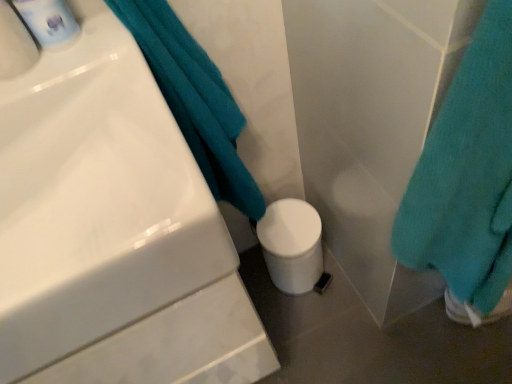
In order to face teal soft towel at upper left, the 1th bath towel positioned from the left, should I rotate leftwards or rightwards?

Turn left by 8.368 degrees to look at teal soft towel at upper left, the 1th bath towel positioned from the left.

You are a GUI agent. You are given a task and a screenshot of the screen. Output one action in this format:
    pyautogui.click(x=<x>, y=<y>)
    Task: Click on the white glossy sink at upper left
    The width and height of the screenshot is (512, 384).
    Given the screenshot: What is the action you would take?
    pyautogui.click(x=112, y=232)

Is teal soft towel at lower right, the 2th bath towel viewed from the left, in contact with white glossy mouthwash at upper left?

No, teal soft towel at lower right, the 2th bath towel viewed from the left, is not with white glossy mouthwash at upper left.

Which point is more forward, (494,319) or (35,30)?

The point (35,30) is closer.

From a real-world perspective, who is located higher, teal soft towel at lower right, which is counted as the first bath towel, starting from the right, or white glossy mouthwash at upper left?

From a 3D spatial view, white glossy mouthwash at upper left is above.

Would you say teal soft towel at lower right, which is counted as the first bath towel, starting from the right, contains white glossy mouthwash at upper left?

No, white glossy mouthwash at upper left is not a part of teal soft towel at lower right, which is counted as the first bath towel, starting from the right.

Does point (439, 234) come in front of point (117, 175)?

No.

The width and height of the screenshot is (512, 384). Identify the location of bath towel that is below the white glossy sink at upper left (from the image's perspective). (467, 181).

Could you tell me if teal soft towel at lower right, the 2th bath towel viewed from the left, is turned towards white glossy sink at upper left?

No, teal soft towel at lower right, the 2th bath towel viewed from the left, is not turned towards white glossy sink at upper left.

Based on the photo, considering the sizes of objects teal soft towel at lower right, the 2th bath towel viewed from the left, and white glossy sink at upper left in the image provided, who is wider, teal soft towel at lower right, the 2th bath towel viewed from the left, or white glossy sink at upper left?

white glossy sink at upper left is wider.

How many degrees apart are the facing directions of teal soft towel at lower right, which is counted as the first bath towel, starting from the right, and teal soft towel at upper left, the 1th bath towel positioned from the left?

The angular difference between teal soft towel at lower right, which is counted as the first bath towel, starting from the right, and teal soft towel at upper left, the 1th bath towel positioned from the left, is 0.175 degrees.

Considering the relative positions of teal soft towel at lower right, which is counted as the first bath towel, starting from the right, and teal soft towel at upper left, the 1th bath towel positioned from the left, in the image provided, is teal soft towel at lower right, which is counted as the first bath towel, starting from the right, to the left of teal soft towel at upper left, the 1th bath towel positioned from the left, from the viewer's perspective?

Incorrect, teal soft towel at lower right, which is counted as the first bath towel, starting from the right, is not on the left side of teal soft towel at upper left, the 1th bath towel positioned from the left.

Is teal soft towel at lower right, the 2th bath towel viewed from the left, next to teal soft towel at upper left, the 1th bath towel positioned from the left, and touching it?

No, teal soft towel at lower right, the 2th bath towel viewed from the left, is not making contact with teal soft towel at upper left, the 1th bath towel positioned from the left.

Does teal soft towel at lower right, the 2th bath towel viewed from the left, come behind teal soft towel at upper left, which appears as the second bath towel when viewed from the right?

No, it is in front of teal soft towel at upper left, which appears as the second bath towel when viewed from the right.

From a real-world perspective, who is located lower, white glossy sink at upper left or white glossy mouthwash at upper left?

From a 3D spatial view, white glossy sink at upper left is below.

Measure the distance from white glossy sink at upper left to white glossy mouthwash at upper left.

12.92 inches.

Is white glossy sink at upper left shorter than white glossy mouthwash at upper left?

Yes.

Is white glossy sink at upper left positioned far away from white glossy mouthwash at upper left?

No, white glossy sink at upper left is in close proximity to white glossy mouthwash at upper left.

Identify the location of mouthwash above the teal soft towel at lower right, the 2th bath towel viewed from the left (from a real-world perspective). This screenshot has height=384, width=512. (49, 22).

Which of these two, white glossy mouthwash at upper left or teal soft towel at lower right, which is counted as the first bath towel, starting from the right, stands taller?

With more height is teal soft towel at lower right, which is counted as the first bath towel, starting from the right.

How many degrees apart are the facing directions of white glossy mouthwash at upper left and teal soft towel at lower right, the 2th bath towel viewed from the left?

The facing directions of white glossy mouthwash at upper left and teal soft towel at lower right, the 2th bath towel viewed from the left, are 3.75 degrees apart.

How distant is white glossy mouthwash at upper left from teal soft towel at lower right, which is counted as the first bath towel, starting from the right?

white glossy mouthwash at upper left and teal soft towel at lower right, which is counted as the first bath towel, starting from the right, are 24.04 inches apart from each other.

From the image's perspective, between white glossy mouthwash at upper left and teal soft towel at upper left, which appears as the second bath towel when viewed from the right, which one is located above?

From the image's view, white glossy mouthwash at upper left is above.

Is point (30, 13) farther from viewer compared to point (193, 104)?

No, (30, 13) is closer to viewer.

Who is taller, white glossy mouthwash at upper left or teal soft towel at upper left, which appears as the second bath towel when viewed from the right?

Standing taller between the two is teal soft towel at upper left, which appears as the second bath towel when viewed from the right.

Are white glossy mouthwash at upper left and white glossy sink at upper left located far from each other?

They are positioned close to each other.

Does white glossy mouthwash at upper left turn towards white glossy sink at upper left?

Yes.

Considering the sizes of objects white glossy mouthwash at upper left and white glossy sink at upper left in the image provided, who is thinner, white glossy mouthwash at upper left or white glossy sink at upper left?

With smaller width is white glossy mouthwash at upper left.

Which object is further away from the camera taking this photo, white glossy mouthwash at upper left or white glossy sink at upper left?

white glossy mouthwash at upper left is further from the camera.

At what (x,y) coordinates should I click in order to perform the action: click on bath towel in front of the white glossy mouthwash at upper left. Please return your answer as a coordinate pair (x, y). The width and height of the screenshot is (512, 384). Looking at the image, I should click on (467, 181).

Find the location of a particular element. sink that is above the teal soft towel at lower right, which is counted as the first bath towel, starting from the right (from the image's perspective) is located at coordinates pos(112,232).

From the image, which object appears to be farther from teal soft towel at lower right, the 2th bath towel viewed from the left, white glossy sink at upper left or white glossy mouthwash at upper left?

white glossy mouthwash at upper left lies further to teal soft towel at lower right, the 2th bath towel viewed from the left, than the other object.

Which object lies nearer to the anchor point white glossy sink at upper left, teal soft towel at lower right, the 2th bath towel viewed from the left, or white glossy mouthwash at upper left?

Among the two, white glossy mouthwash at upper left is located nearer to white glossy sink at upper left.

Which object lies further to the anchor point teal soft towel at upper left, the 1th bath towel positioned from the left, teal soft towel at lower right, the 2th bath towel viewed from the left, or white glossy mouthwash at upper left?

teal soft towel at lower right, the 2th bath towel viewed from the left, lies further to teal soft towel at upper left, the 1th bath towel positioned from the left, than the other object.

From the image, which object appears to be farther from white glossy sink at upper left, white glossy mouthwash at upper left or teal soft towel at lower right, which is counted as the first bath towel, starting from the right?

The object further to white glossy sink at upper left is teal soft towel at lower right, which is counted as the first bath towel, starting from the right.

Based on their spatial positions, is teal soft towel at upper left, the 1th bath towel positioned from the left, or white glossy sink at upper left closer to teal soft towel at lower right, which is counted as the first bath towel, starting from the right?

The object closer to teal soft towel at lower right, which is counted as the first bath towel, starting from the right, is teal soft towel at upper left, the 1th bath towel positioned from the left.

From the image, which object appears to be farther from teal soft towel at lower right, the 2th bath towel viewed from the left, white glossy sink at upper left or teal soft towel at upper left, the 1th bath towel positioned from the left?

The object further to teal soft towel at lower right, the 2th bath towel viewed from the left, is white glossy sink at upper left.

Consider the image. From the image, which object appears to be farther from teal soft towel at upper left, which appears as the second bath towel when viewed from the right, white glossy sink at upper left or teal soft towel at lower right, which is counted as the first bath towel, starting from the right?

Among the two, teal soft towel at lower right, which is counted as the first bath towel, starting from the right, is located further to teal soft towel at upper left, which appears as the second bath towel when viewed from the right.

Considering their positions, is teal soft towel at lower right, the 2th bath towel viewed from the left, positioned closer to white glossy sink at upper left than teal soft towel at upper left, which appears as the second bath towel when viewed from the right?

teal soft towel at upper left, which appears as the second bath towel when viewed from the right, is closer to white glossy sink at upper left.

The height and width of the screenshot is (384, 512). I want to click on bath towel between white glossy mouthwash at upper left and teal soft towel at lower right, the 2th bath towel viewed from the left, in the horizontal direction, so click(194, 100).

Identify the location of bath towel located between white glossy sink at upper left and teal soft towel at lower right, the 2th bath towel viewed from the left, in the left-right direction. The width and height of the screenshot is (512, 384). (194, 100).

This screenshot has height=384, width=512. Identify the location of bath towel between white glossy mouthwash at upper left and white glossy sink at upper left in the up-down direction. (194, 100).

You are a GUI agent. You are given a task and a screenshot of the screen. Output one action in this format:
    pyautogui.click(x=<x>, y=<y>)
    Task: Click on the sink situated between white glossy mouthwash at upper left and teal soft towel at lower right, which is counted as the first bath towel, starting from the right, from left to right
    The width and height of the screenshot is (512, 384).
    Given the screenshot: What is the action you would take?
    pyautogui.click(x=112, y=232)